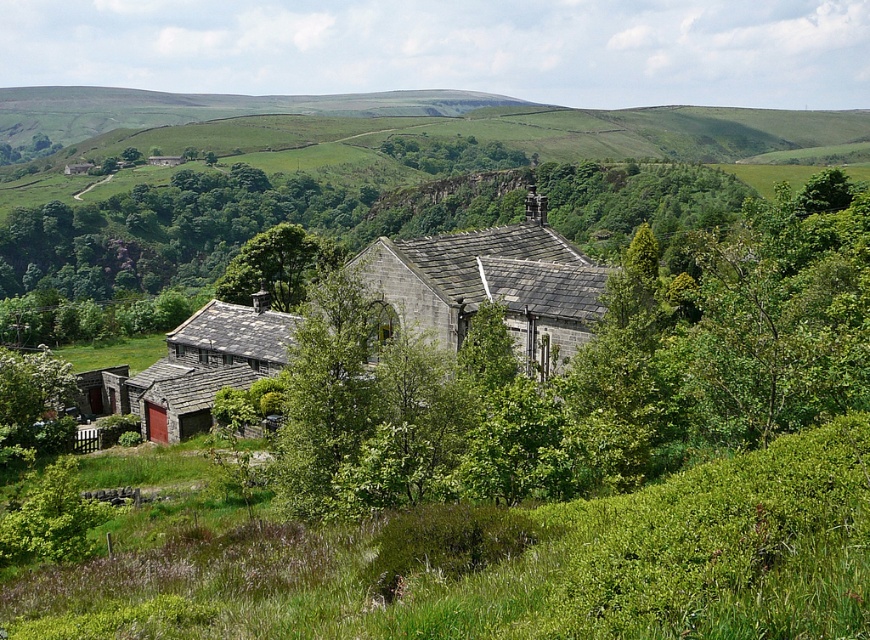
Question: Considering the real-world distances, which object is farthest from the green leafy grass at lower center?

Choices:
 (A) gray stone building at center
 (B) stone textured hut at lower left
 (C) green leafy tree at center

Answer: (B)

Question: Is green leafy grass at lower center to the left of gray stone building at center from the viewer's perspective?

Choices:
 (A) yes
 (B) no

Answer: (A)

Question: Which point appears farthest from the camera in this image?

Choices:
 (A) (601, 273)
 (B) (168, 440)
 (C) (235, 291)
 (D) (761, 461)

Answer: (C)

Question: Can you confirm if gray stone building at center is wider than stone textured hut at lower left?

Choices:
 (A) yes
 (B) no

Answer: (A)

Question: Which is farther from the stone textured hut at lower left?

Choices:
 (A) green leafy grass at lower center
 (B) green leafy tree at center

Answer: (A)

Question: Is green leafy grass at lower center below gray stone building at center?

Choices:
 (A) no
 (B) yes

Answer: (B)